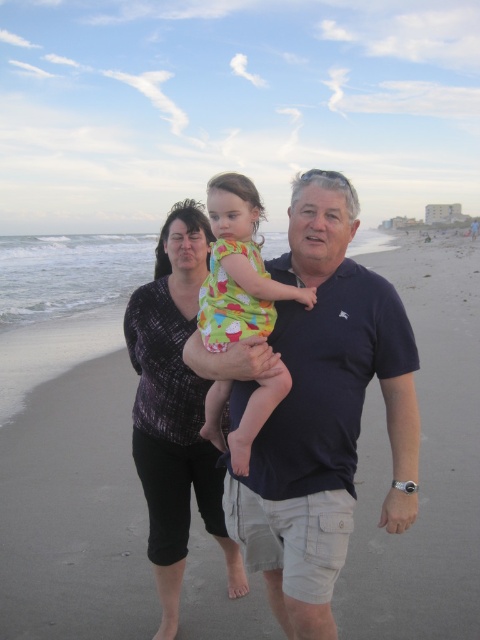
Question: Which object appears closest to the camera in this image?

Choices:
 (A) printed cotton dress at center
 (B) dark blue cotton polo shirt at center
 (C) beige sand at center
 (D) printed fabric dress at center

Answer: (B)

Question: Does dark blue cotton polo shirt at center appear over printed cotton dress at center?

Choices:
 (A) no
 (B) yes

Answer: (A)

Question: Which point is farther to the camera?

Choices:
 (A) (191, 458)
 (B) (327, 449)

Answer: (A)

Question: Does beige sand at center have a greater width compared to dark blue cotton polo shirt at center?

Choices:
 (A) no
 (B) yes

Answer: (B)

Question: Does dark blue cotton polo shirt at center have a lesser width compared to printed cotton dress at center?

Choices:
 (A) no
 (B) yes

Answer: (A)

Question: Which point appears closest to the camera in this image?

Choices:
 (A) (97, 580)
 (B) (177, 355)

Answer: (B)